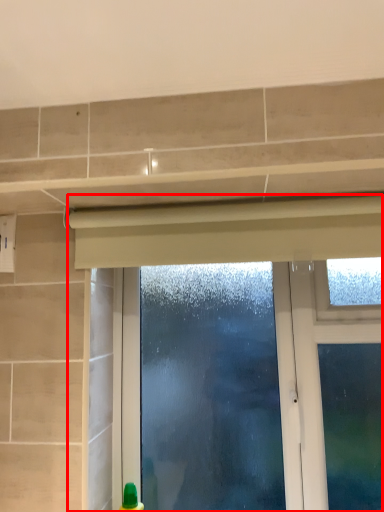
Question: Observing the image, what is the correct spatial positioning of window (annotated by the red box) in reference to curtain?

Choices:
 (A) right
 (B) left

Answer: (A)